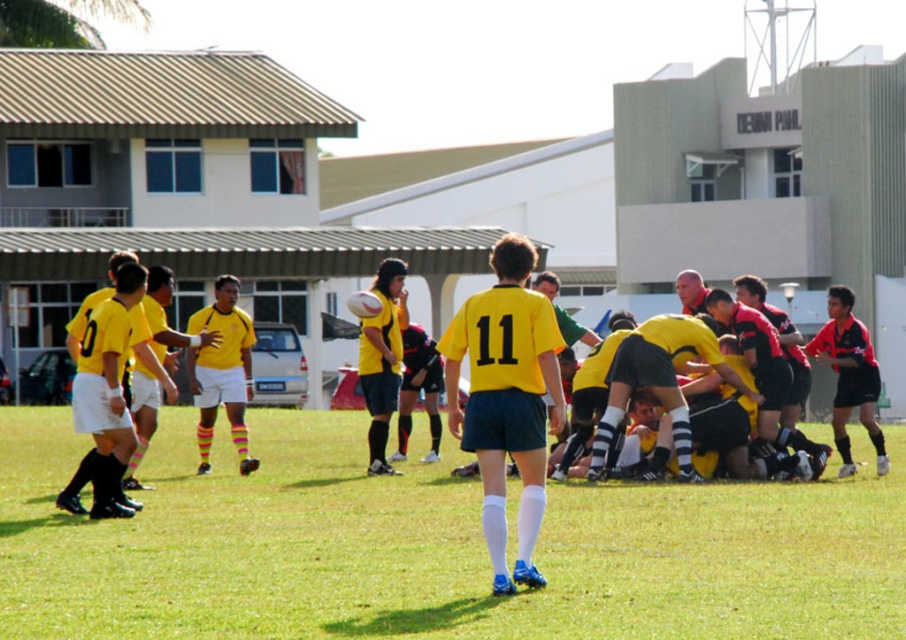
Between green grass at center and yellow matte jersey at center, which one has less height?

green grass at center is shorter.

Is green grass at center wider than yellow matte jersey at center?

Yes, green grass at center is wider than yellow matte jersey at center.

Find the location of a particular element. green grass at center is located at coordinates (x=431, y=548).

Locate an element on the screen. green grass at center is located at coordinates (431, 548).